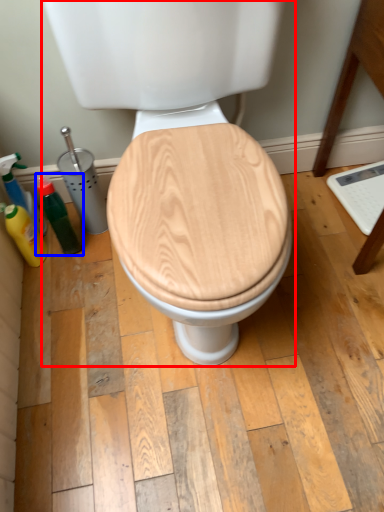
Question: Which object is further to the camera taking this photo, toilet (highlighted by a red box) or bottle (highlighted by a blue box)?

Choices:
 (A) toilet
 (B) bottle

Answer: (B)